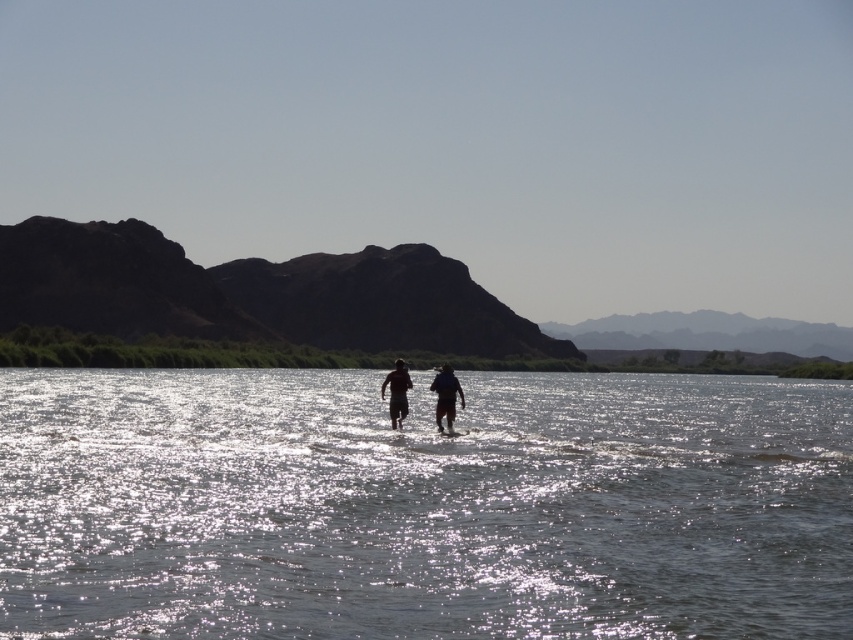
Does point (531, 612) come closer to viewer compared to point (454, 387)?

That is True.

Can you confirm if sparkling silver water at center is positioned to the left of silhouette running couple at center?

In fact, sparkling silver water at center is to the right of silhouette running couple at center.

Which is behind, point (383, 445) or point (463, 396)?

Positioned behind is point (463, 396).

Where is `sparkling silver water at center`? sparkling silver water at center is located at coordinates (422, 506).

Is silhouette running couple at center closer to camera compared to dark blue fabric shirt at center?

Yes, it is.

Which is behind, point (405, 406) or point (460, 403)?

The point (460, 403) is behind.

What do you see at coordinates (445, 396) in the screenshot?
I see `silhouette running couple at center` at bounding box center [445, 396].

At what (x,y) coordinates should I click in order to perform the action: click on silhouette running couple at center. Please return your answer as a coordinate pair (x, y). Looking at the image, I should click on 445,396.

Between dark blue fabric shirt at center and matte black shorts at center, which one appears on the left side from the viewer's perspective?

matte black shorts at center is more to the left.

Does dark blue fabric shirt at center appear over matte black shorts at center?

Incorrect, dark blue fabric shirt at center is not positioned above matte black shorts at center.

You are a GUI agent. You are given a task and a screenshot of the screen. Output one action in this format:
    pyautogui.click(x=<x>, y=<y>)
    Task: Click on the dark blue fabric shirt at center
    The width and height of the screenshot is (853, 640).
    Given the screenshot: What is the action you would take?
    pyautogui.click(x=445, y=396)